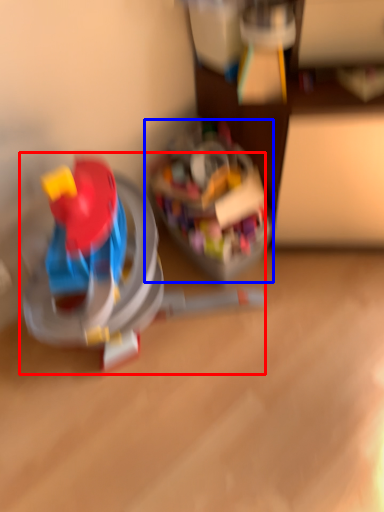
Question: Which object appears farthest to the camera in this image, toy (highlighted by a red box) or toy (highlighted by a blue box)?

Choices:
 (A) toy
 (B) toy

Answer: (B)